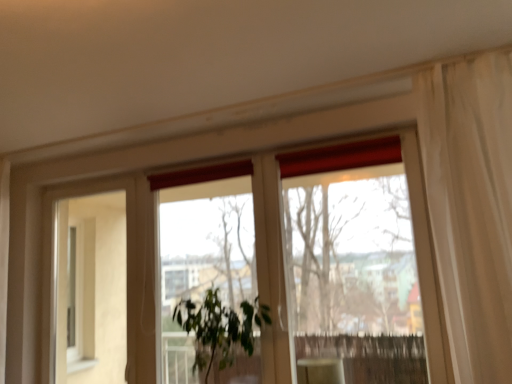
Question: Is matte white cabinet at lower center in front of or behind transparent glass window at center in the image?

Choices:
 (A) front
 (B) behind

Answer: (A)

Question: Considering the positions of matte white cabinet at lower center and transparent glass window at center in the image, is matte white cabinet at lower center wider or thinner than transparent glass window at center?

Choices:
 (A) thin
 (B) wide

Answer: (B)

Question: Estimate the real-world distances between objects in this image. Which object is farther from the green leafy plant at center?

Choices:
 (A) matte white cabinet at lower center
 (B) beige matte screen door at left
 (C) transparent glass window at center

Answer: (B)

Question: Estimate the real-world distances between objects in this image. Which object is farther from the matte white cabinet at lower center?

Choices:
 (A) beige matte screen door at left
 (B) green leafy plant at center
 (C) transparent glass window at center

Answer: (A)